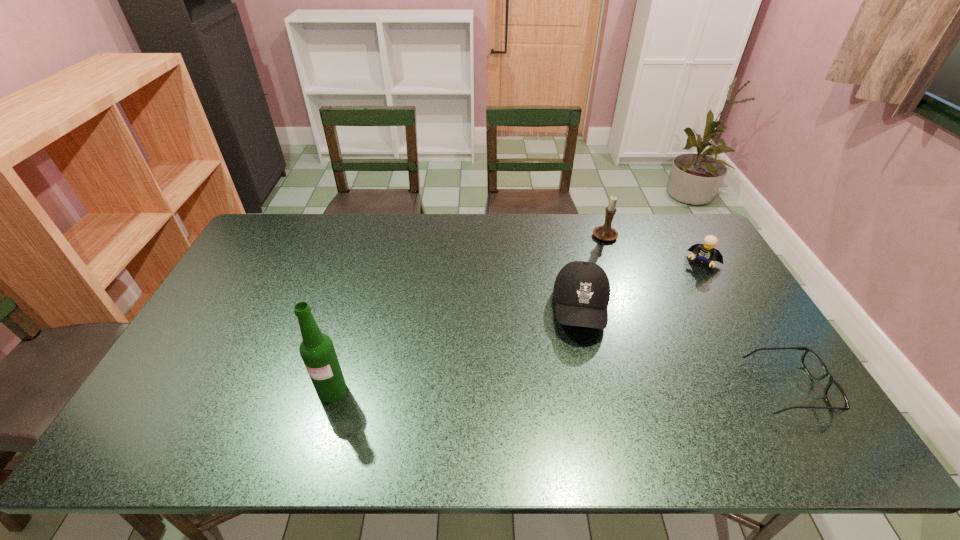
You are a GUI agent. You are given a task and a screenshot of the screen. Output one action in this format:
    pyautogui.click(x=<x>, y=<y>)
    Task: Click on the free point located on the front-facing side of the fourth object from right to left
    
    Given the screenshot: What is the action you would take?
    pyautogui.click(x=586, y=379)

I want to click on blank area located 0.280m on the front-facing side of the fourth nearest object, so click(666, 323).

Find the location of a particular element. vacant area situated 0.250m on the front-facing side of the fourth nearest object is located at coordinates (669, 317).

Identify the location of free space located on the front-facing side of the fourth nearest object. This screenshot has height=540, width=960. (652, 347).

This screenshot has height=540, width=960. What are the coordinates of `vacant area located 0.260m on the side of the third object from right to left with the handle` in the screenshot? It's located at (570, 288).

The width and height of the screenshot is (960, 540). I want to click on blank space located 0.260m on the side of the third object from right to left with the handle, so click(570, 288).

This screenshot has width=960, height=540. Identify the location of vacant space situated on the side of the third object from right to left with the handle. (582, 272).

Identify the location of Lego present at the far edge. (706, 252).

Identify the location of candle holder present at the far edge. The image size is (960, 540). (605, 233).

In order to click on beer bottle located in the near edge section of the desktop in this screenshot , I will do point(317,350).